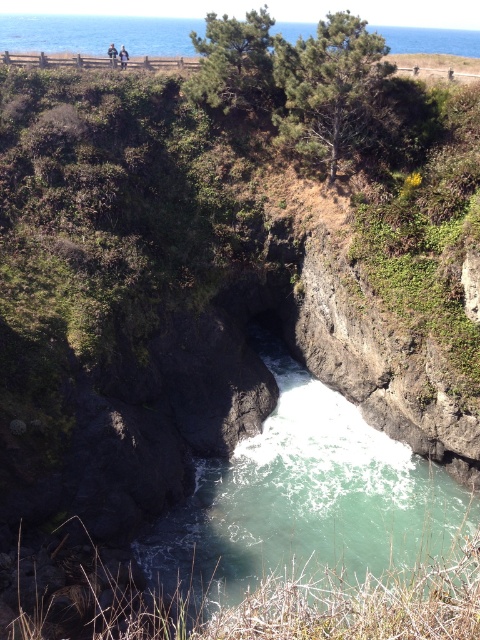
You are a hiker standing at the base of the cliff and want to reach the grassy area above. You see the green smooth river at center and the green rock river at upper center. Which river should you cross to get closer to the grassy area?

The green smooth river at center is in front of the green rock river at upper center, so crossing the green smooth river at center would bring you closer to the grassy area.

Based on the photo, you are a hiker planning to cross both the green smooth river at center and the green rock river at upper center. Which river should you choose if you want to cross the smaller one?

You should choose the green smooth river at center because it is smaller than the green rock river at upper center.